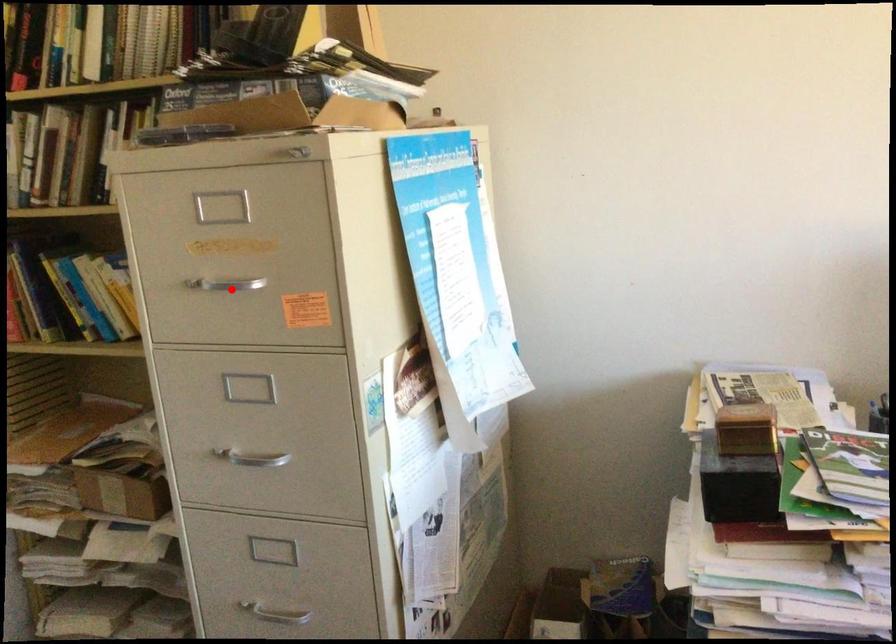
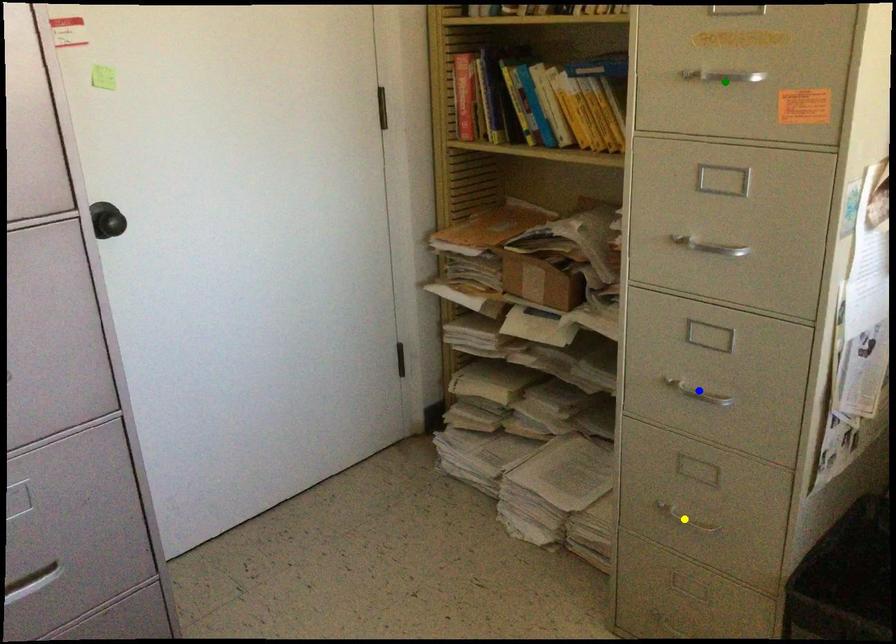
Question: I am providing you with two images of the same scene from different viewpoints. A red point is marked on the first image. You are given multiple points on the second image. In image 2, which mark is for the same physical point as the one in image 1?

Choices:
 (A) green point
 (B) blue point
 (C) yellow point

Answer: (A)